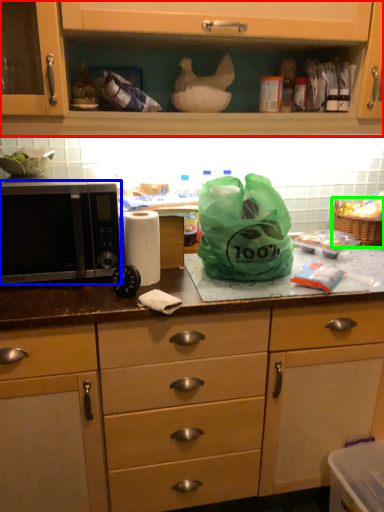
Question: Which object is positioned closest to cabinetry (highlighted by a red box)? Select from microwave oven (highlighted by a blue box) and picnic basket (highlighted by a green box).

Choices:
 (A) microwave oven
 (B) picnic basket

Answer: (A)